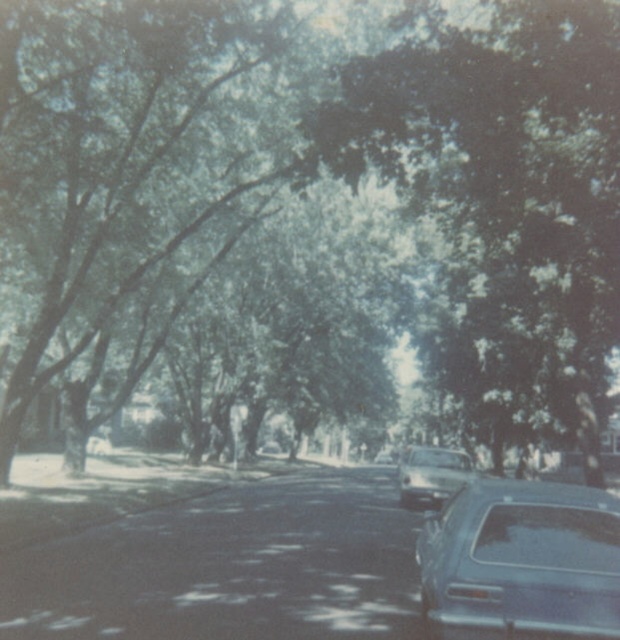
Identify the location of green leafy tree at center. Image resolution: width=620 pixels, height=640 pixels. (505, 202).

What do you see at coordinates (505, 202) in the screenshot? The height and width of the screenshot is (640, 620). I see `green leafy tree at center` at bounding box center [505, 202].

I want to click on green leafy tree at center, so click(x=505, y=202).

Measure the distance between point (x=585, y=572) and camera.

Point (x=585, y=572) and camera are 17.27 feet apart.

Is shiny blue sedan at lower right to the left of shiny silver car at center from the viewer's perspective?

No, shiny blue sedan at lower right is not to the left of shiny silver car at center.

Find the location of `shiny blue sedan at lower right`. shiny blue sedan at lower right is located at coordinates (521, 563).

Identify the location of shiny blue sedan at lower right. The image size is (620, 640). point(521,563).

Is green leafy tree at center below shiny blue sedan at lower right?

Actually, green leafy tree at center is above shiny blue sedan at lower right.

Is point (595, 376) in front of point (463, 497)?

No, it is behind (463, 497).

Measure the distance between green leafy tree at center and camera.

green leafy tree at center is 10.83 meters from camera.

Locate an element on the screen. green leafy tree at center is located at coordinates [505, 202].